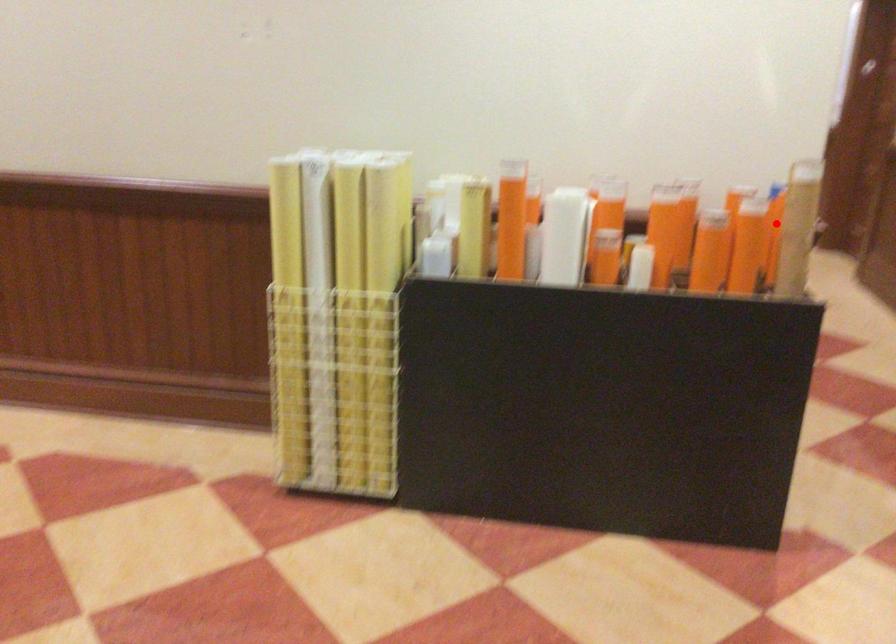
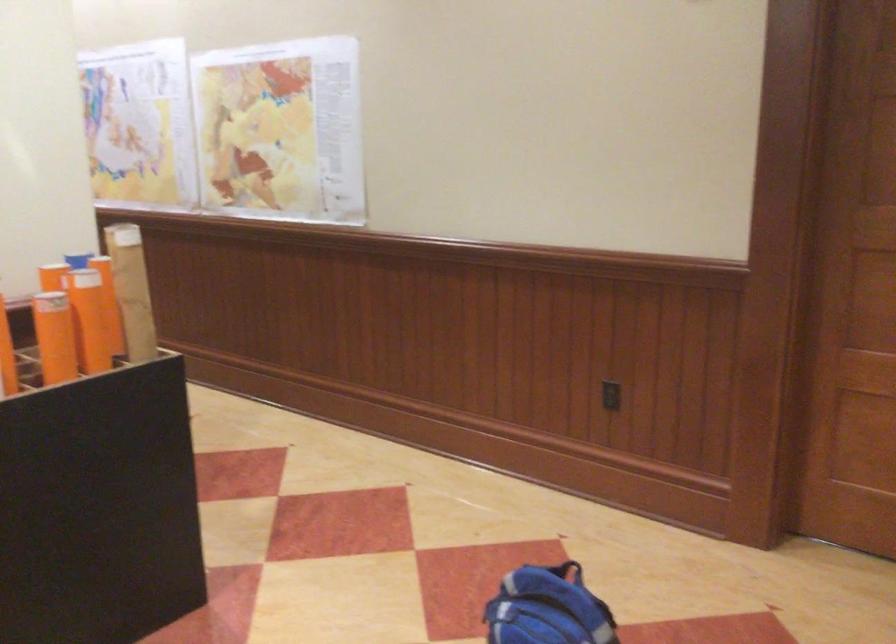
Find the pixel in the second image that matches the highlighted location in the first image.

(132, 290)